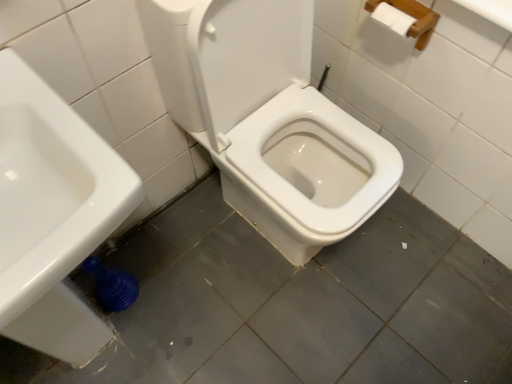
Question: From a real-world perspective, does white glossy sink at lower left sit lower than white glossy toilet at center?

Choices:
 (A) no
 (B) yes

Answer: (A)

Question: Could white glossy toilet at center be considered to be inside white glossy sink at lower left?

Choices:
 (A) no
 (B) yes

Answer: (A)

Question: Can you confirm if white glossy sink at lower left is positioned to the left of white glossy toilet at center?

Choices:
 (A) yes
 (B) no

Answer: (A)

Question: Is white glossy sink at lower left beside white glossy toilet at center?

Choices:
 (A) yes
 (B) no

Answer: (B)

Question: Does white glossy sink at lower left have a greater height compared to white glossy toilet at center?

Choices:
 (A) yes
 (B) no

Answer: (A)

Question: Does white glossy sink at lower left have a lesser width compared to white glossy toilet at center?

Choices:
 (A) yes
 (B) no

Answer: (A)

Question: Could you tell me if white glossy toilet at center is turned towards white glossy sink at lower left?

Choices:
 (A) no
 (B) yes

Answer: (A)

Question: Is white glossy toilet at center completely or partially outside of white glossy sink at lower left?

Choices:
 (A) yes
 (B) no

Answer: (A)

Question: From the image's perspective, is white glossy toilet at center located above white glossy sink at lower left?

Choices:
 (A) no
 (B) yes

Answer: (B)

Question: Can you confirm if white glossy toilet at center is bigger than white glossy sink at lower left?

Choices:
 (A) yes
 (B) no

Answer: (B)

Question: Considering the relative sizes of white glossy toilet at center and white glossy sink at lower left in the image provided, is white glossy toilet at center thinner than white glossy sink at lower left?

Choices:
 (A) yes
 (B) no

Answer: (B)

Question: Can you confirm if white glossy toilet at center is taller than white glossy sink at lower left?

Choices:
 (A) no
 (B) yes

Answer: (A)

Question: In the image, is white glossy sink at lower left positioned in front of or behind white glossy toilet at center?

Choices:
 (A) behind
 (B) front

Answer: (B)